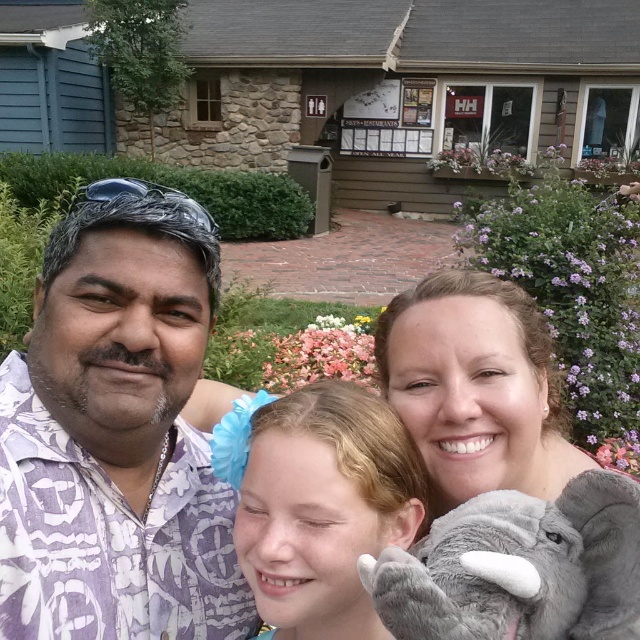
You are a photographer taking a picture of the light brown hair at center and the gray plush elephant at lower center. Which object is positioned lower in the image?

The light brown hair at center is located below the gray plush elephant at lower center, so it is positioned lower in the image.

Please provide the 2D coordinates of the light brown hair at center in the image. The coordinates should be in the format of a tuple with two decimal numbers separated by a comma, enclosed in parentheses. For example, if the coordinates were at 0.5 and 0.5, you would write the answer as follows. Answer the question based on the provided information. Do not add any extra text or explanation. The answer must be exactly in the format specified. If the coordinates are not provided in the input, respond with an

The 2D coordinates of the light brown hair at center are at point (317, 502). So the answer is (317, 502).

You are a photographer setting up a shot of the scene described. You need to ensure that the purple printed shirt at center and the gray plush elephant at lower center are both in frame. Considering their positions, which object is positioned more to the left?

The purple printed shirt at center is positioned more to the left than the gray plush elephant at lower center.